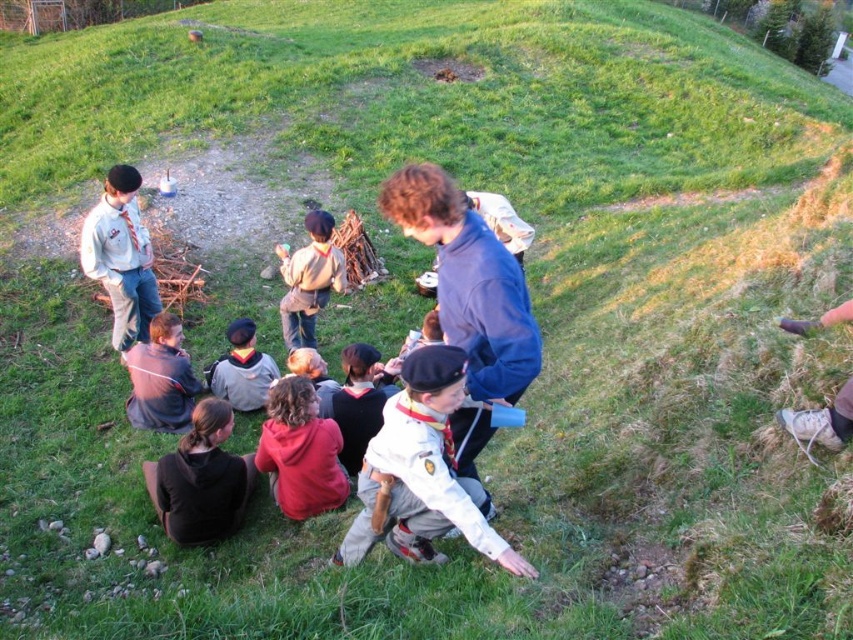
You are standing at the origin point of the coordinate system in this image. You need to locate the white cotton shirt at lower center. What are its coordinates?

The white cotton shirt at lower center is located at coordinates point [422,472].

From the picture: You are part of the group on the grassy hillside. You need to identify which clothing item is shorter in height between the red fleece jacket at lower center and the brown fabric shirt at center. Which one is it?

The red fleece jacket at lower center has a lesser height compared to the brown fabric shirt at center, so the red fleece jacket at lower center is shorter in height.